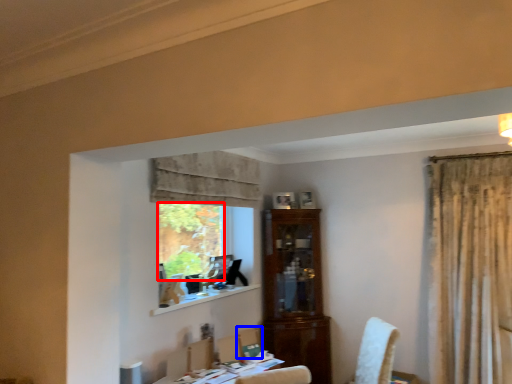
Question: Which object is further to the camera taking this photo, window screen (highlighted by a red box) or chair (highlighted by a blue box)?

Choices:
 (A) window screen
 (B) chair

Answer: (A)